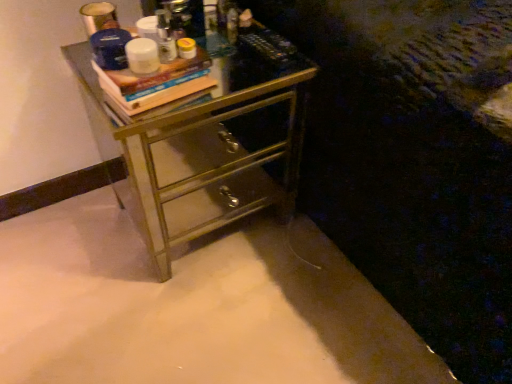
The width and height of the screenshot is (512, 384). Find the location of `vacant space underneath metallic gold chest of drawers at center (from a real-world perspective)`. vacant space underneath metallic gold chest of drawers at center (from a real-world perspective) is located at coordinates (212, 215).